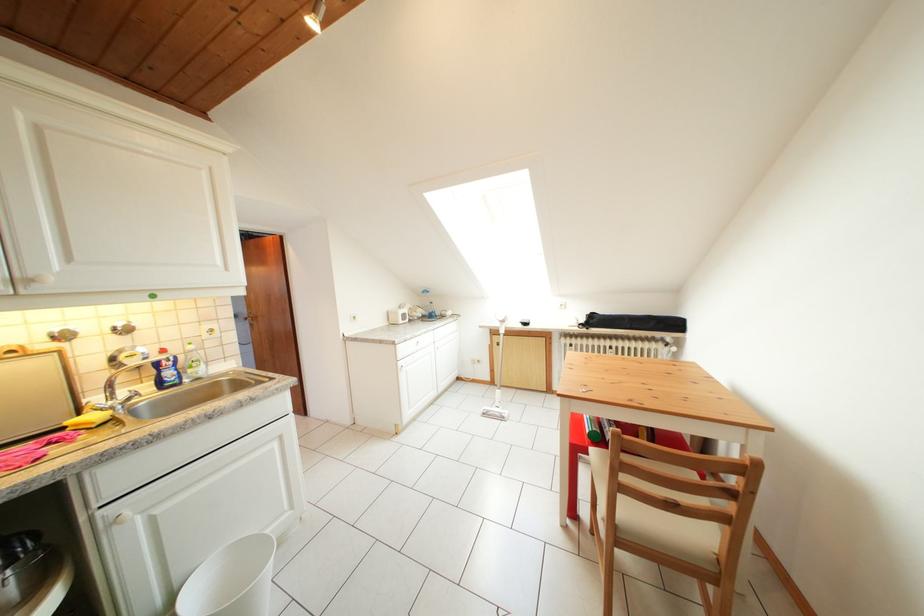
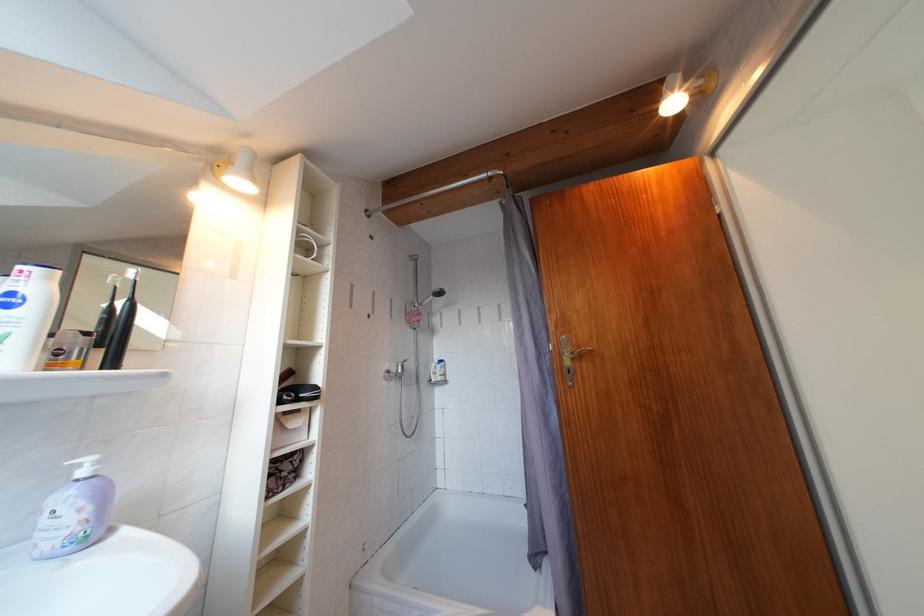
The images are taken continuously from a first-person perspective. In which direction are you moving?

The cameraman moved toward left, forward.